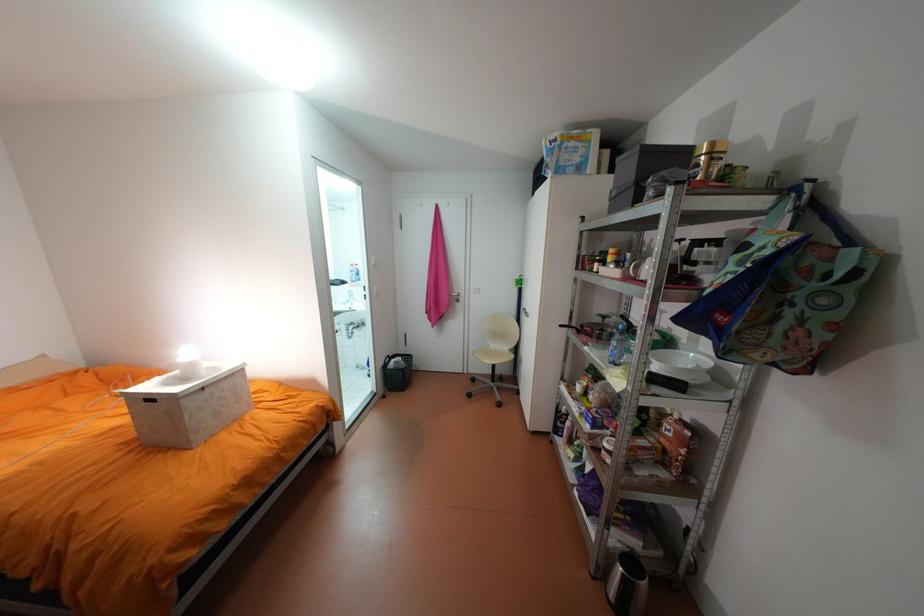
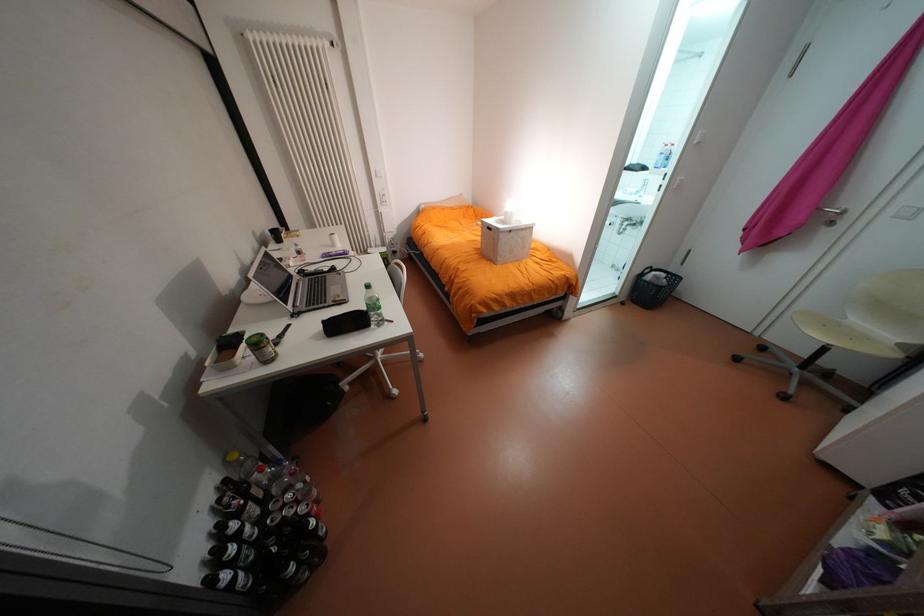
Where in the second image is the point corresponding to pixel 497 352 from the first image?

(840, 323)